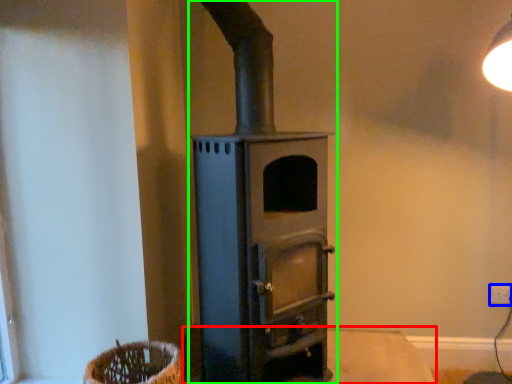
Question: Considering the real-world distances, which object is closest to table (highlighted by a red box)? electric outlet (highlighted by a blue box) or wood burning stove (highlighted by a green box).

Choices:
 (A) electric outlet
 (B) wood burning stove

Answer: (A)